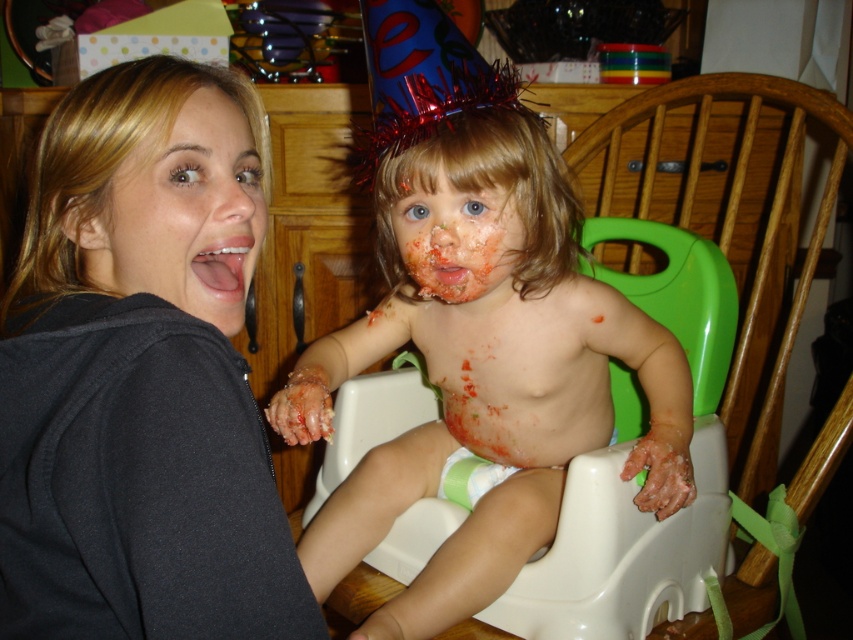
You are a photographer taking a picture of the birthday celebration. You want to ensure that the smooth skin face at left is centered in the frame. Which direction should you move the camera to achieve this?

The smooth skin face at left is currently positioned at point 0.334 on the x and 0.223 on the y. To center it, move the camera slightly to the right and down to adjust the frame.

You are a photographer trying to capture a closeup of the matte plastic baby at center without the matte black hoodie at upper left appearing in the frame. Given their current positions, is this possible?

The matte black hoodie at upper left and matte plastic baby at center are 12.30 inches apart. Since the distance between them is relatively small, it might be challenging to frame the matte plastic baby at center without including the matte black hoodie at upper left in the shot unless you adjust your angle or zoom in closely.

You are a photographer standing in front of the scene. You want to take a closeup photo of the matte black hoodie at upper left without moving any objects. Can you get a clear shot of it?

The matte black hoodie at upper left is 16.23 inches from viewer, so yes, you can take a clear closeup photo of it without moving any objects since it is within a reasonable distance for focusing.